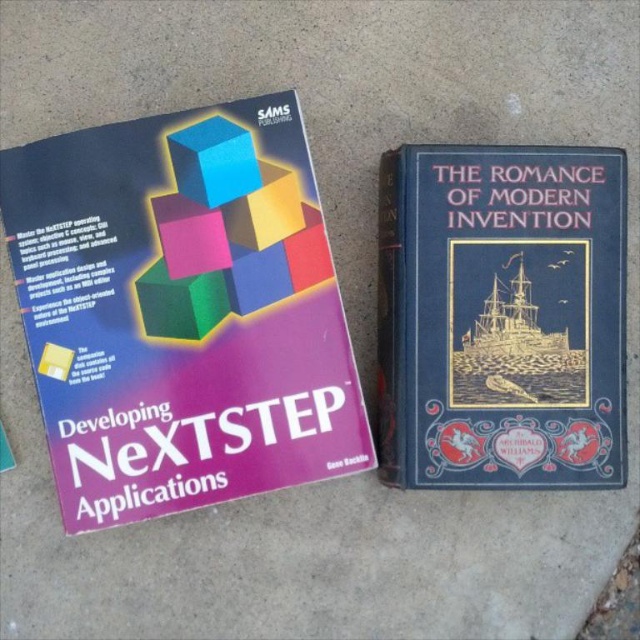
Question: Among these points, which one is nearest to the camera?

Choices:
 (A) (538, 419)
 (B) (193, 184)

Answer: (A)

Question: Among these points, which one is farthest from the camera?

Choices:
 (A) [x=272, y=470]
 (B) [x=173, y=144]

Answer: (A)

Question: Can you confirm if matte purple book at left is positioned to the left of blue matte cube at upper left?

Choices:
 (A) no
 (B) yes

Answer: (B)

Question: Considering the relative positions of blue hardcover book at right and blue matte cube at upper left in the image provided, where is blue hardcover book at right located with respect to blue matte cube at upper left?

Choices:
 (A) above
 (B) below

Answer: (B)

Question: Is matte purple book at left in front of blue matte cube at upper left?

Choices:
 (A) no
 (B) yes

Answer: (B)

Question: Which object is closer to the camera taking this photo?

Choices:
 (A) blue hardcover book at right
 (B) matte purple book at left

Answer: (B)